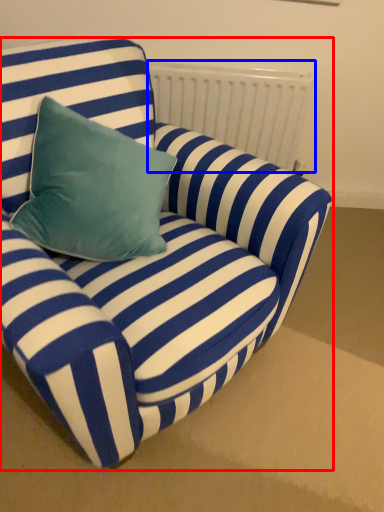
Question: Which object is closer to the camera taking this photo, studio couch (highlighted by a red box) or radiator (highlighted by a blue box)?

Choices:
 (A) studio couch
 (B) radiator

Answer: (A)